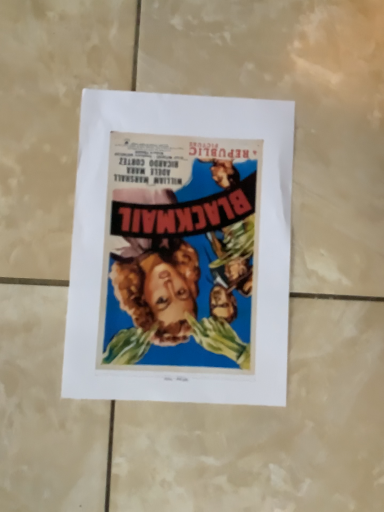
The image size is (384, 512). What do you see at coordinates (180, 249) in the screenshot?
I see `matte paper poster at center` at bounding box center [180, 249].

Where is `matte paper poster at center`? The image size is (384, 512). matte paper poster at center is located at coordinates (180, 249).

What are the coordinates of `matte paper poster at center` in the screenshot? It's located at (180, 249).